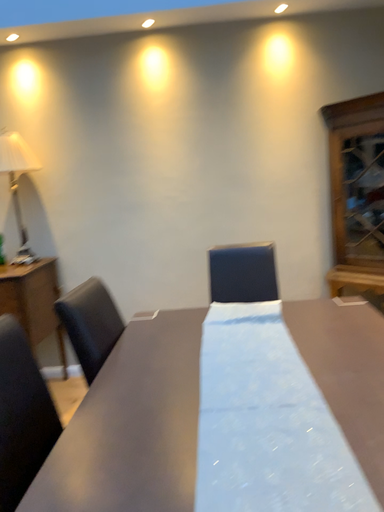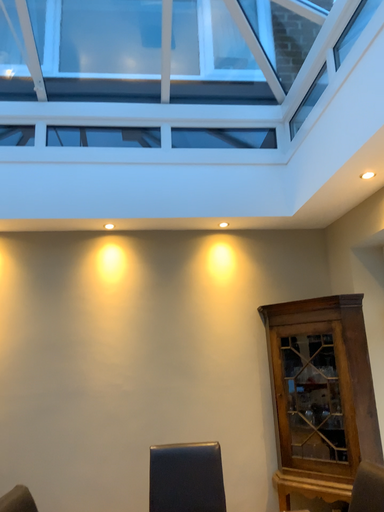
Question: How did the camera likely rotate when shooting the video?

Choices:
 (A) rotated left
 (B) rotated right

Answer: (B)